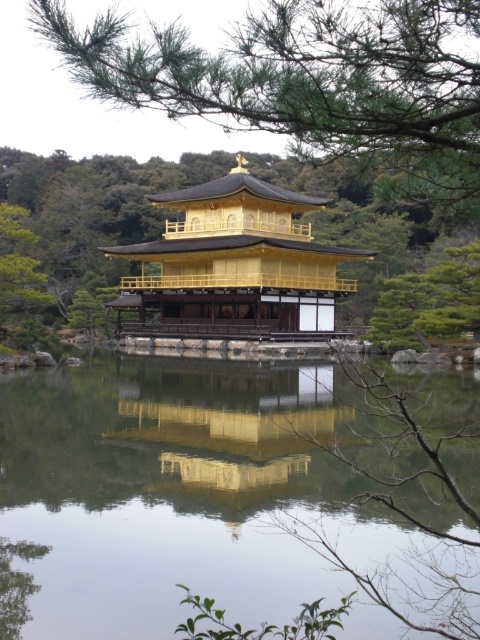
In the scene shown: You are a visitor at the Golden Pavilion and notice a green leafy branch at upper center and a gold reflective surface at center. Which object is located to the right of the other?

The green leafy branch at upper center is positioned on the right side of gold reflective surface at center.

You are a photographer planning to capture the Golden Pavilion and the branch in your shot. Given that the green leafy branch at upper center is smaller than the gold lacquered pagoda at center, which object should you focus on first if you want to ensure both are in frame without cropping?

You should focus on the gold lacquered pagoda at center first since it is larger than the green leafy branch at upper center, ensuring it fits properly before adjusting the frame to include the smaller branch.